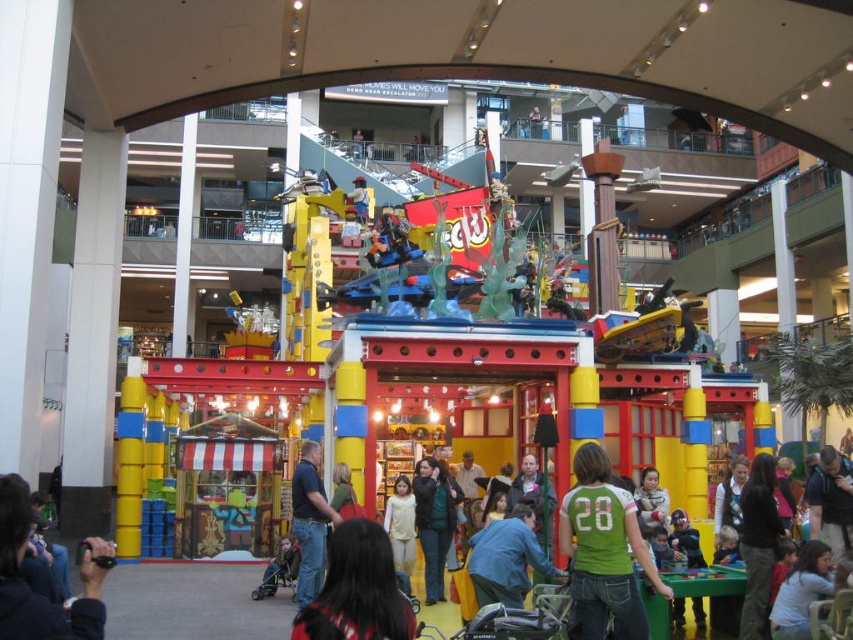
Is point (483, 541) positioned after point (440, 531)?

No, it is not.

Which is more to the right, blue denim jeans at center or green matte jacket at center?

blue denim jeans at center is more to the right.

Is point (526, 570) positioned after point (433, 496)?

No, it is in front of (433, 496).

I want to click on blue denim jeans at center, so click(x=506, y=560).

Based on the photo, who is lower down, blue denim jeans at center or light beige sweater at center?

Positioned lower is light beige sweater at center.

Can you confirm if blue denim jeans at center is wider than light beige sweater at center?

Yes, blue denim jeans at center is wider than light beige sweater at center.

Does point (482, 573) come behind point (386, 525)?

That is False.

The height and width of the screenshot is (640, 853). Identify the location of blue denim jeans at center. (506, 560).

Looking at this image, is green matte jacket at center below matte pink shirt at lower right?

Indeed, green matte jacket at center is positioned under matte pink shirt at lower right.

Which is in front, point (426, 596) or point (654, 470)?

Point (426, 596) is more forward.

Describe the element at coordinates (434, 522) in the screenshot. I see `green matte jacket at center` at that location.

Identify the location of green matte jacket at center. The width and height of the screenshot is (853, 640). (434, 522).